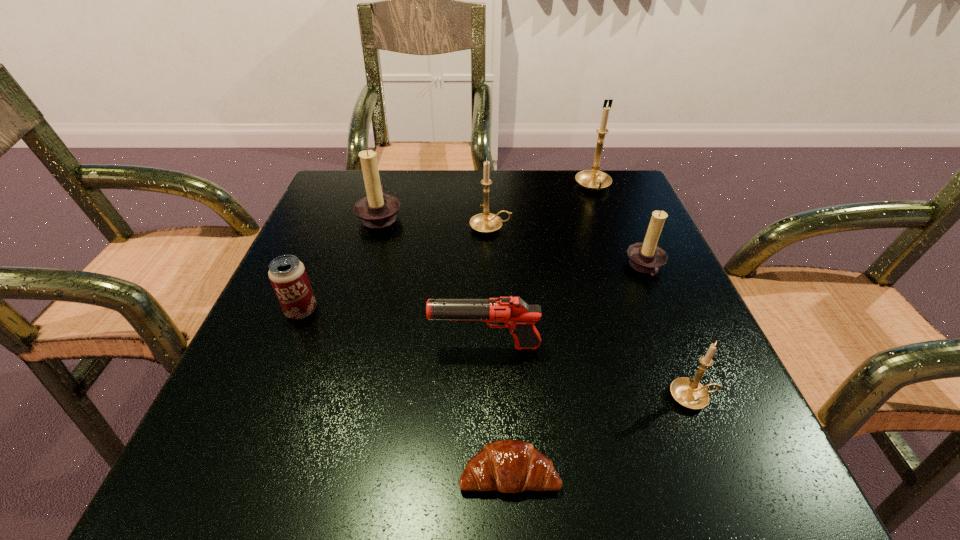
At what (x,y) coordinates should I click in order to perform the action: click on black gun. Please return your answer as a coordinate pair (x, y). Looking at the image, I should click on (511, 312).

I want to click on gun, so [511, 312].

The height and width of the screenshot is (540, 960). In order to click on the leftmost object in this screenshot , I will do `click(287, 274)`.

At what (x,y) coordinates should I click in order to perform the action: click on beer can. Please return your answer as a coordinate pair (x, y). Looking at the image, I should click on (287, 274).

Locate an element on the screen. This screenshot has width=960, height=540. the shortest object is located at coordinates (510, 466).

You are a GUI agent. You are given a task and a screenshot of the screen. Output one action in this format:
    pyautogui.click(x=<x>, y=<y>)
    Task: Click on the brown crescent roll
    The width and height of the screenshot is (960, 540).
    Given the screenshot: What is the action you would take?
    pyautogui.click(x=510, y=466)

Locate an element on the screen. The image size is (960, 540). vacant space located 0.280m on the handle side of the biggest gold candle holder is located at coordinates (628, 280).

Locate an element on the screen. This screenshot has width=960, height=540. vacant space located on the wick of the leftmost candle holder is located at coordinates (536, 214).

Identify the location of blank space located on the handle side of the second smallest gold candle holder. (563, 227).

Find the location of a particular element. The width and height of the screenshot is (960, 540). free space located 0.140m on the wick of the smaller brown candle holder is located at coordinates (555, 267).